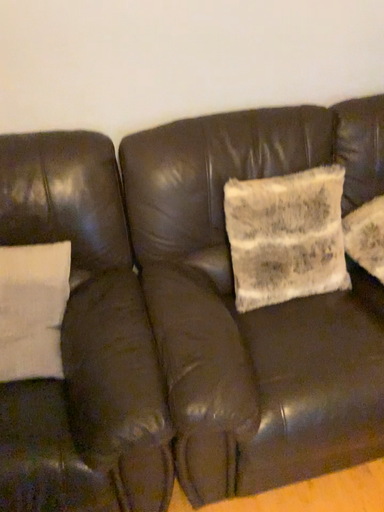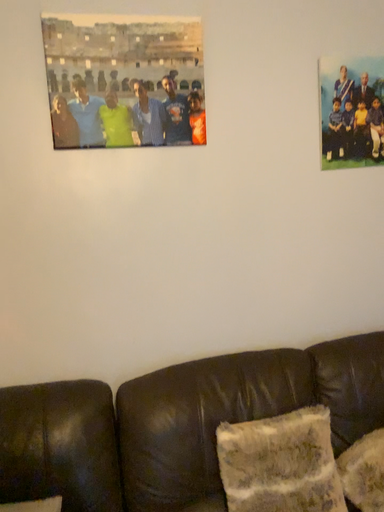
Question: How did the camera likely rotate when shooting the video?

Choices:
 (A) rotated downward
 (B) rotated upward

Answer: (B)